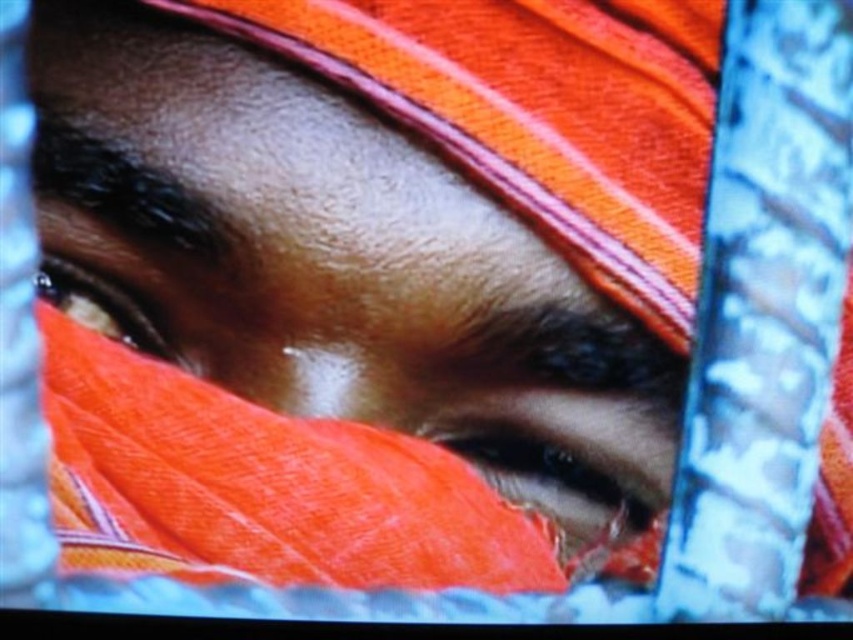
You are an artist trying to sketch this scene. You need to determine the correct placement of the orange fabric at center and the matte orange eye at center. Based on the image, which object is positioned lower?

The orange fabric at center is located below the matte orange eye at center, so the orange fabric at center is positioned lower.

You are an artist trying to sketch this scene. You notice the orange fabric at center and the matte orange eye at upper left. Which object should you draw first if you want to start with the larger one?

The orange fabric at center is bigger than the matte orange eye at upper left, so you should draw the orange fabric at center first.